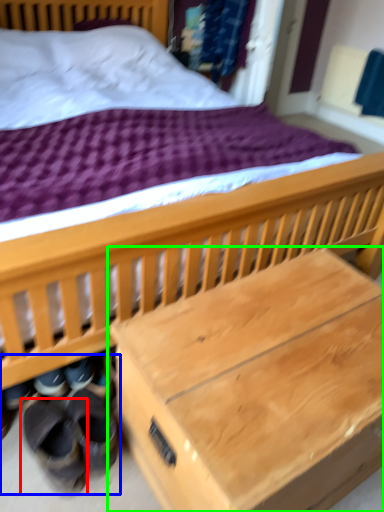
Question: Which object is the farthest from footwear (highlighted by a red box)? Choose among these: shoe (highlighted by a blue box) or table (highlighted by a green box).

Choices:
 (A) shoe
 (B) table

Answer: (B)